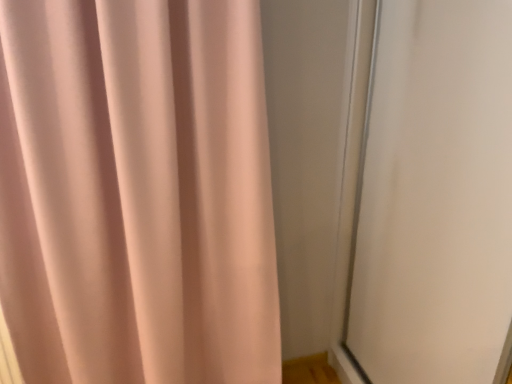
This screenshot has width=512, height=384. Identify the location of matte pink curtain at left. (136, 193).

What do you see at coordinates (136, 193) in the screenshot? The width and height of the screenshot is (512, 384). I see `matte pink curtain at left` at bounding box center [136, 193].

Measure the distance between matte pink curtain at left and camera.

matte pink curtain at left is 1.03 meters away from camera.

The image size is (512, 384). Identify the location of matte pink curtain at left. (136, 193).